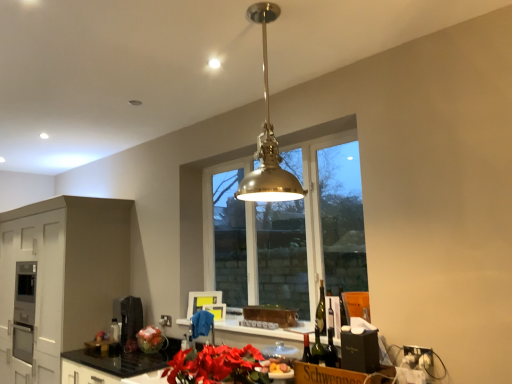
Question: From the image's perspective, is black granite countertop at lower center, which is the second countertop from left to right, located beneath matte metallic vase at lower center?

Choices:
 (A) no
 (B) yes

Answer: (B)

Question: Is black granite countertop at lower center, which is the second countertop from left to right, turned away from matte metallic vase at lower center?

Choices:
 (A) yes
 (B) no

Answer: (B)

Question: Can you confirm if black granite countertop at lower center, placed as the first countertop when sorted from right to left, is bigger than matte metallic vase at lower center?

Choices:
 (A) yes
 (B) no

Answer: (A)

Question: From a real-world perspective, is black granite countertop at lower center, which is the second countertop from left to right, under matte metallic vase at lower center?

Choices:
 (A) no
 (B) yes

Answer: (B)

Question: Is black granite countertop at lower center, which is the second countertop from left to right, far from matte metallic vase at lower center?

Choices:
 (A) yes
 (B) no

Answer: (B)

Question: Is black granite countertop at lower center, which is the second countertop from left to right, at the left side of matte metallic vase at lower center?

Choices:
 (A) no
 (B) yes

Answer: (A)

Question: From a real-world perspective, is matte metallic vase at lower center under brass/polished metal pendant light at center?

Choices:
 (A) no
 (B) yes

Answer: (B)

Question: Is matte metallic vase at lower center thinner than brass/polished metal pendant light at center?

Choices:
 (A) yes
 (B) no

Answer: (A)

Question: From the image's perspective, would you say matte metallic vase at lower center is positioned over brass/polished metal pendant light at center?

Choices:
 (A) no
 (B) yes

Answer: (A)

Question: Is matte metallic vase at lower center facing towards brass/polished metal pendant light at center?

Choices:
 (A) yes
 (B) no

Answer: (B)

Question: Is matte metallic vase at lower center not within brass/polished metal pendant light at center?

Choices:
 (A) no
 (B) yes

Answer: (B)

Question: Is matte metallic vase at lower center beside brass/polished metal pendant light at center?

Choices:
 (A) no
 (B) yes

Answer: (A)

Question: Is matte black coffee machine at lower left, which is the first appliance in back-to-front order, oriented away from white matte cabinetry at lower left?

Choices:
 (A) yes
 (B) no

Answer: (B)